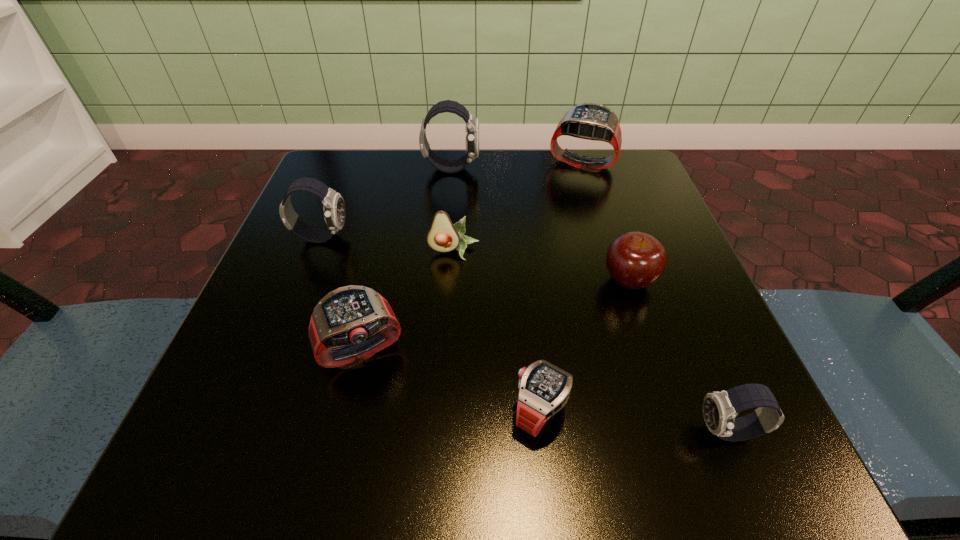
Identify the location of free space between the second red watch from right to left and the avocado. This screenshot has width=960, height=540. (497, 332).

Find the location of `empty location between the nearest dark watch and the fourth nearest object`. empty location between the nearest dark watch and the fourth nearest object is located at coordinates (679, 356).

I want to click on vacant point located between the biggest red watch and the smallest dark watch, so click(x=656, y=298).

Identify the location of vacant area that lies between the fourth object from right to left and the leftmost watch. (431, 325).

Locate an element on the screen. The height and width of the screenshot is (540, 960). object that is the fourth closest to the biggest red watch is located at coordinates (334, 208).

Identify which object is located as the second nearest to the smallest dark watch. Please provide its 2D coordinates. Your answer should be formatted as a tuple, i.e. [(x, y)], where the tuple contains the x and y coordinates of a point satisfying the conditions above.

[(635, 260)]

Select which watch appears as the second closest to the fifth farthest object. Please provide its 2D coordinates. Your answer should be formatted as a tuple, i.e. [(x, y)], where the tuple contains the x and y coordinates of a point satisfying the conditions above.

[(719, 408)]

I want to click on the closest watch to the fourth nearest object, so click(544, 389).

Identify which dark watch is the closest to the nearest red watch. Please provide its 2D coordinates. Your answer should be formatted as a tuple, i.e. [(x, y)], where the tuple contains the x and y coordinates of a point satisfying the conditions above.

[(719, 408)]

Identify which dark watch is the closest to the biggest dark watch. Please provide its 2D coordinates. Your answer should be formatted as a tuple, i.e. [(x, y)], where the tuple contains the x and y coordinates of a point satisfying the conditions above.

[(334, 208)]